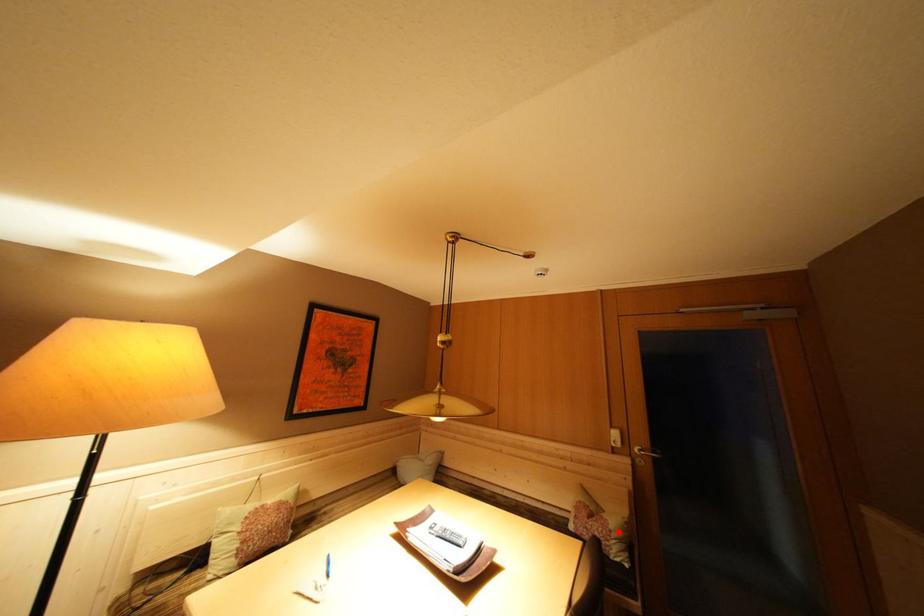
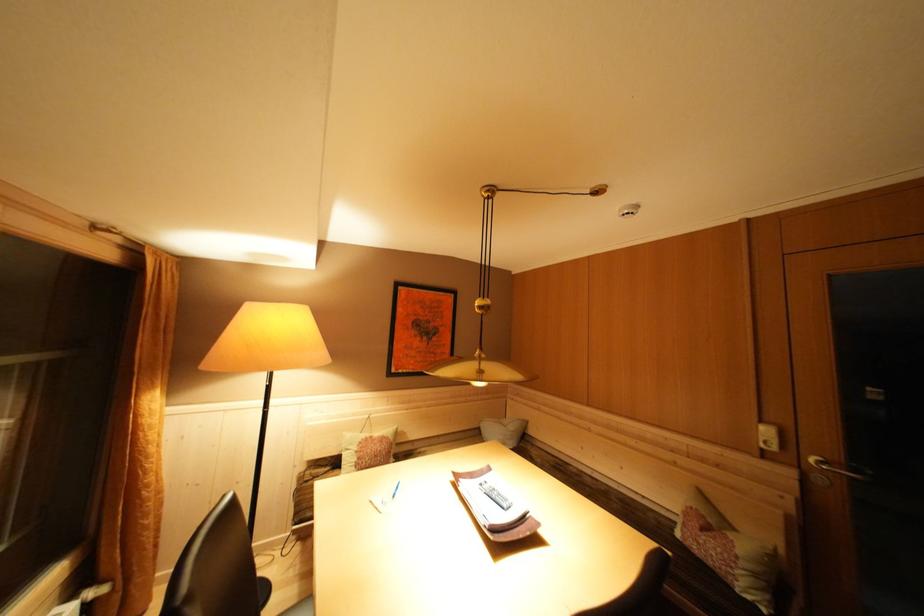
In the second image, find the point that corresponds to the highlighted location in the first image.

(746, 557)